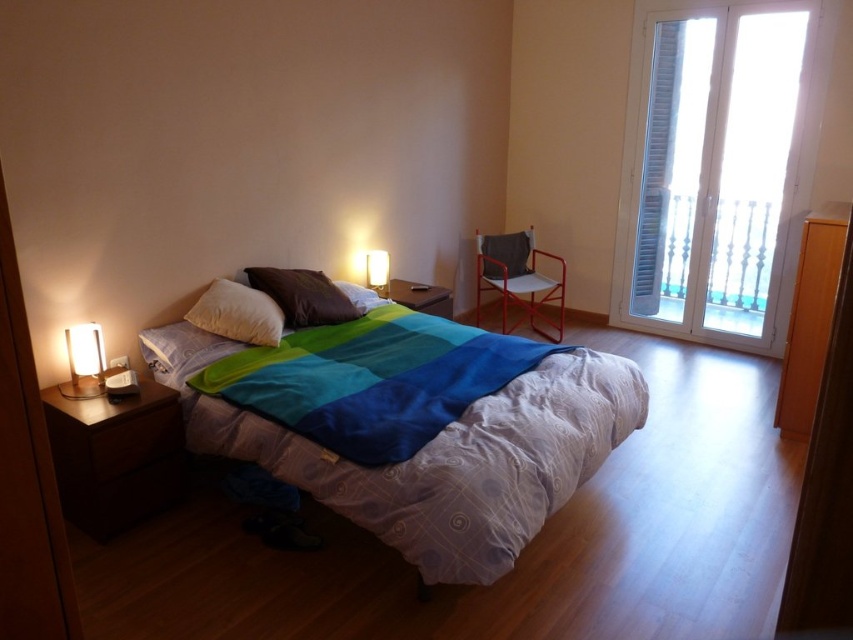
Who is higher up, multicolored fabric blanket at center or suede-like brown pillow at center?

Positioned higher is suede-like brown pillow at center.

Where is `multicolored fabric blanket at center`? Image resolution: width=853 pixels, height=640 pixels. multicolored fabric blanket at center is located at coordinates (372, 380).

In order to click on multicolored fabric blanket at center in this screenshot , I will do `click(372, 380)`.

Which is below, white glass door at upper right or matte white lamp at left?

Positioned lower is matte white lamp at left.

Where is `white glass door at upper right`? This screenshot has width=853, height=640. white glass door at upper right is located at coordinates (714, 172).

Who is more forward, [660,272] or [97,352]?

Positioned in front is point [97,352].

What are the coordinates of `white glass door at upper right` in the screenshot? It's located at (714, 172).

Who is positioned more to the left, textured cotton bed at center or brown matte pillow at center?

brown matte pillow at center

Does textured cotton bed at center have a larger size compared to brown matte pillow at center?

Yes, textured cotton bed at center is bigger than brown matte pillow at center.

Which is in front, point (428, 520) or point (299, 280)?

Point (428, 520) is more forward.

This screenshot has width=853, height=640. Find the location of `textured cotton bed at center`. textured cotton bed at center is located at coordinates (438, 456).